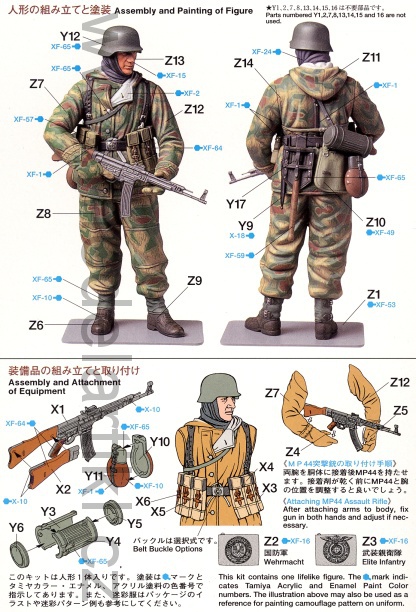
You are a GUI agent. You are given a task and a screenshot of the screen. Output one action in this format:
    pyautogui.click(x=<x>, y=<y>)
    Task: Click on the mat
    
    Given the screenshot: What is the action you would take?
    pyautogui.click(x=125, y=330)